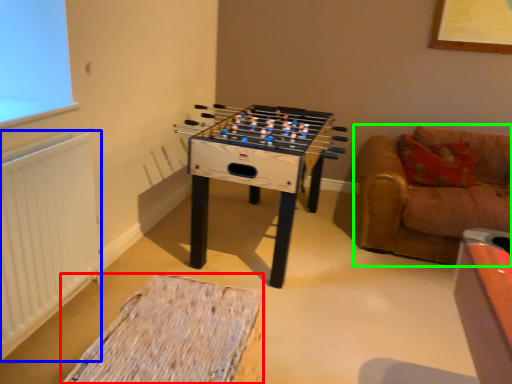
Question: Which object is the farthest from furniture (highlighted by a red box)? Choose among these: radiator (highlighted by a blue box) or studio couch (highlighted by a green box).

Choices:
 (A) radiator
 (B) studio couch

Answer: (B)